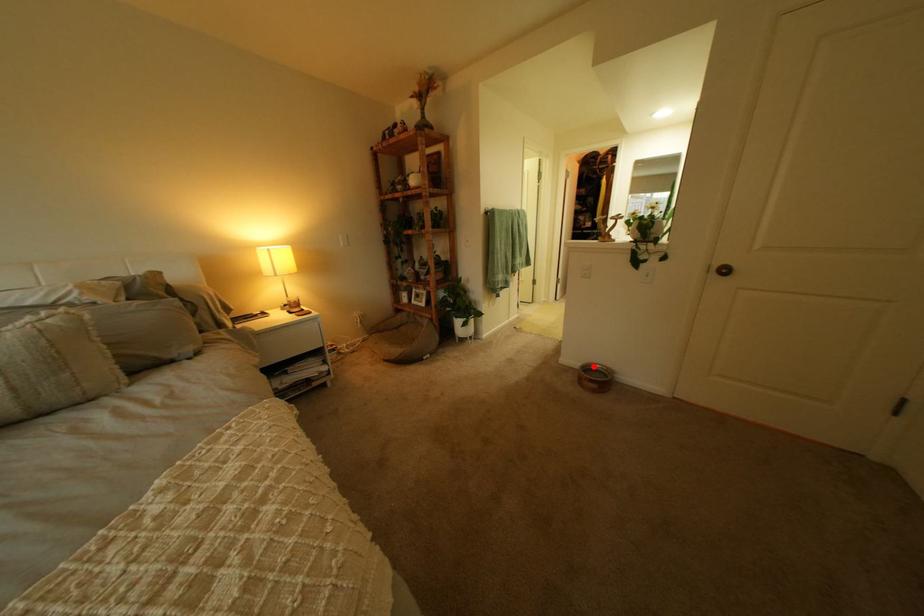
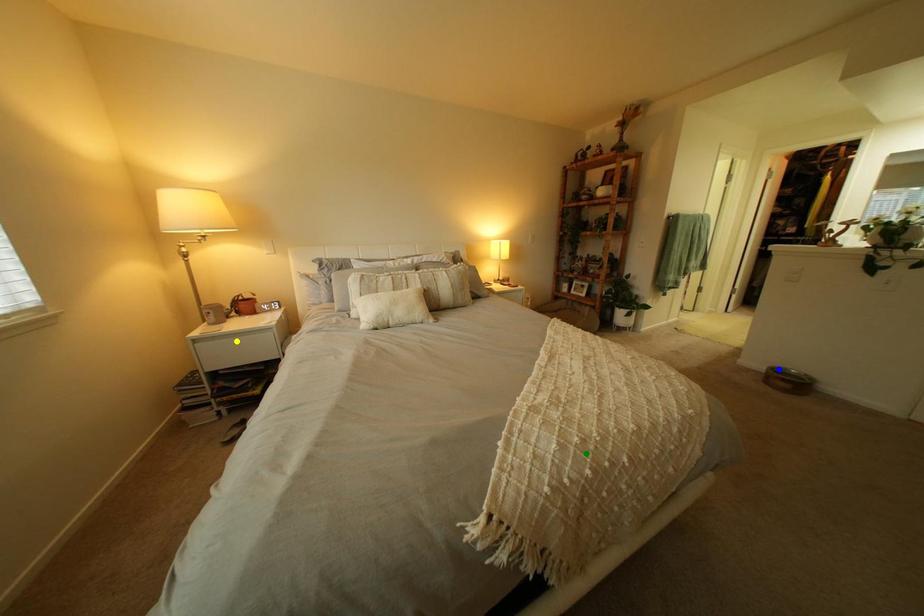
Question: I am providing you with two images of the same scene from different viewpoints. A red point is marked on the first image. You are given multiple points on the second image. Which point in image 2 represents the same 3d spot as the red point in image 1?

Choices:
 (A) yellow point
 (B) blue point
 (C) green point

Answer: (B)